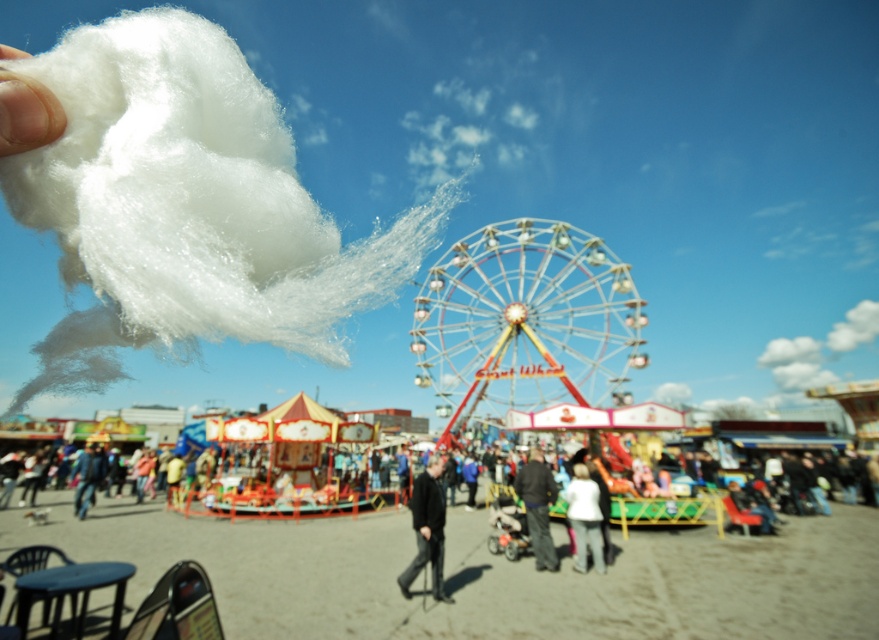
Question: Which point is closer to the camera?

Choices:
 (A) (574, 509)
 (B) (42, 120)
 (C) (448, 596)

Answer: (B)

Question: Among these objects, which one is farthest from the camera?

Choices:
 (A) black matte jacket at center
 (B) dark gray jacket at center

Answer: (B)

Question: Which object appears farthest from the camera in this image?

Choices:
 (A) dark gray fabric at center
 (B) white cotton candy at lower center

Answer: (A)

Question: Is metallic shiny ferris wheel at center above white cotton candy at lower center?

Choices:
 (A) no
 (B) yes

Answer: (B)

Question: Observing the image, what is the correct spatial positioning of dark gray jacket at center in reference to black matte jacket at center?

Choices:
 (A) below
 (B) above

Answer: (A)

Question: Is the position of white fluffy cotton at upper left more distant than that of white cotton candy at lower center?

Choices:
 (A) no
 (B) yes

Answer: (A)